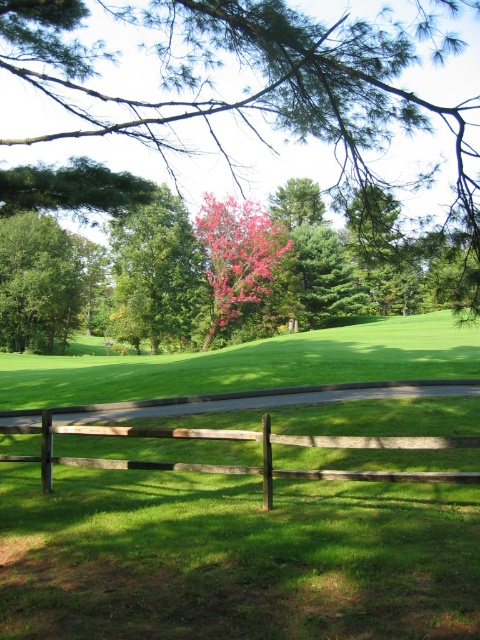
Question: Among these points, which one is nearest to the camera?

Choices:
 (A) (108, 106)
 (B) (229, 241)
 (C) (180, 438)

Answer: (C)

Question: Is brown wooden fence at center below green matte tree at left?

Choices:
 (A) yes
 (B) no

Answer: (A)

Question: Is brown wooden fence at center below reddish-brown textured tree at center?

Choices:
 (A) no
 (B) yes

Answer: (B)

Question: Which is farther from the reddish-brown textured tree at center?

Choices:
 (A) green matte tree at left
 (B) brown wooden fence at center
 (C) bright pink bark at center
 (D) green leafy tree at center

Answer: (B)

Question: Which point is closer to the camera?

Choices:
 (A) green matte tree at left
 (B) green leafy tree at center
 (C) brown wooden fence at center
 (D) reddish-brown textured tree at center

Answer: (C)

Question: Can you confirm if green leafy tree at center is positioned to the right of brown wooden fence at center?

Choices:
 (A) no
 (B) yes

Answer: (A)